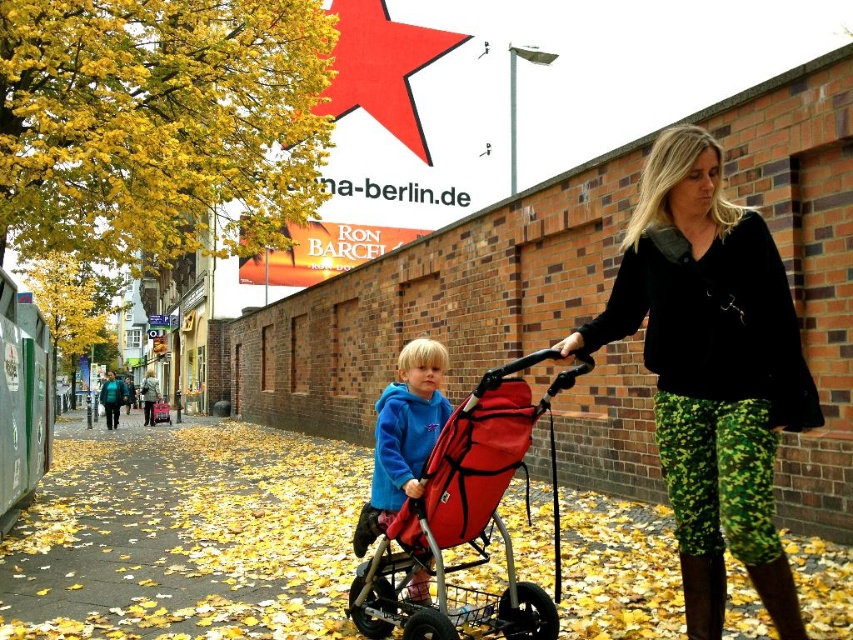
Question: In this image, where is red fabric stroller at center located relative to blue fleece jacket at center?

Choices:
 (A) above
 (B) below

Answer: (B)

Question: Which point appears farthest from the camera in this image?

Choices:
 (A) (390, 22)
 (B) (335, 552)

Answer: (A)

Question: From the image, what is the correct spatial relationship of yellow leaf-covered pavement at center in relation to camouflage pants at center?

Choices:
 (A) left
 (B) right

Answer: (A)

Question: Which point is closer to the camera taking this photo?

Choices:
 (A) (77, 577)
 (B) (422, 637)
 (C) (408, 346)
 (D) (375, 112)

Answer: (B)

Question: Which object is closer to the camera taking this photo?

Choices:
 (A) blue fleece jacket at center
 (B) red fabric stroller at center

Answer: (B)

Question: Can you confirm if yellow leaf-covered pavement at center is smaller than red fabric stroller at center?

Choices:
 (A) yes
 (B) no

Answer: (B)